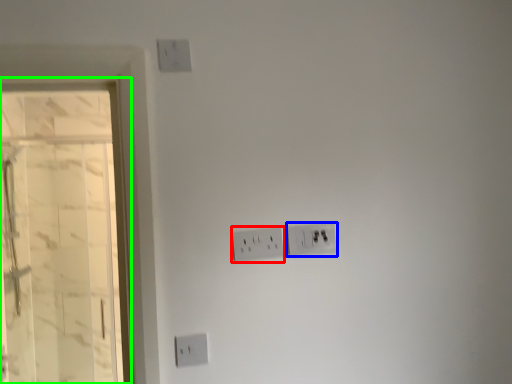
Question: Considering the real-world distances, which object is farthest from power plugs and sockets (highlighted by a red box)? power plugs and sockets (highlighted by a blue box) or glass door (highlighted by a green box)?

Choices:
 (A) power plugs and sockets
 (B) glass door

Answer: (B)